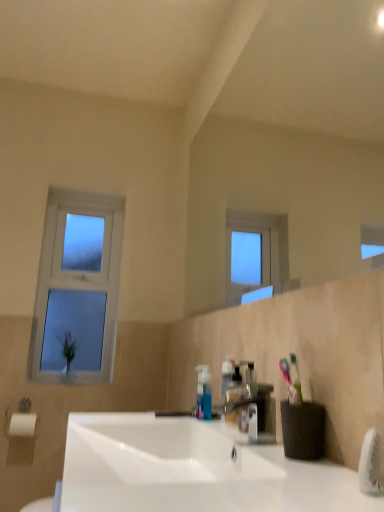
Locate an element on the screen. This screenshot has width=384, height=512. white glossy sink at center is located at coordinates (193, 469).

What do you see at coordinates (251, 409) in the screenshot?
I see `matte plastic tap at center` at bounding box center [251, 409].

Measure the distance between clear glass window at left and camera.

clear glass window at left is 7.07 feet from camera.

Identify the location of clear glass window at left. (77, 288).

Where is `white glossy sink at center`? The height and width of the screenshot is (512, 384). white glossy sink at center is located at coordinates (193, 469).

Who is more distant, clear glass window at left or matte plastic tap at center?

clear glass window at left is more distant.

In terms of width, does clear glass window at left look wider or thinner when compared to matte plastic tap at center?

In the image, clear glass window at left appears to be more narrow than matte plastic tap at center.

Does clear glass window at left turn towards matte plastic tap at center?

Yes, clear glass window at left is facing matte plastic tap at center.

Is clear glass window at left next to matte plastic tap at center and touching it?

No.

Consider the image. Who is bigger, white glossy sink at center or clear glass window at left?

With larger size is white glossy sink at center.

Is white glossy sink at center spatially inside clear glass window at left, or outside of it?

white glossy sink at center is not enclosed by clear glass window at left.

Is white glossy sink at center at the right side of clear glass window at left?

Yes, white glossy sink at center is to the right of clear glass window at left.

From the image's perspective, is white glossy sink at center on clear glass window at left?

Incorrect, from the image's perspective, white glossy sink at center is lower than clear glass window at left.

From the image's perspective, is matte plastic tap at center located beneath white glossy sink at center?

No, from the image's perspective, matte plastic tap at center is not beneath white glossy sink at center.

Could you tell me if matte plastic tap at center is turned towards white glossy sink at center?

No.

Based on the photo, from a real-world perspective, is matte plastic tap at center physically above white glossy sink at center?

Yes, from a real-world perspective, matte plastic tap at center is over white glossy sink at center

Is matte plastic tap at center completely or partially outside of white glossy sink at center?

Absolutely, matte plastic tap at center is external to white glossy sink at center.

Does white glossy sink at center turn towards matte plastic tap at center?

No, white glossy sink at center does not turn towards matte plastic tap at center.

Which object is wider, white glossy sink at center or matte plastic tap at center?

white glossy sink at center.

Between white glossy sink at center and matte plastic tap at center, which one has larger size?

With larger size is white glossy sink at center.

Considering the sizes of matte plastic tap at center and clear glass window at left in the image, is matte plastic tap at center taller or shorter than clear glass window at left?

Clearly, matte plastic tap at center is shorter compared to clear glass window at left.

Is matte plastic tap at center next to clear glass window at left?

Result: matte plastic tap at center and clear glass window at left are clearly separated.

Considering the points (256, 388) and (103, 376), which point is behind, point (256, 388) or point (103, 376)?

The point (103, 376) is behind.

Does matte plastic tap at center turn towards clear glass window at left?

No, matte plastic tap at center is not oriented towards clear glass window at left.

Image resolution: width=384 pixels, height=512 pixels. Identify the location of window above the white glossy sink at center (from a real-world perspective). (77, 288).

Can you confirm if clear glass window at left is shorter than white glossy sink at center?

In fact, clear glass window at left may be taller than white glossy sink at center.

Would you say clear glass window at left is a long distance from white glossy sink at center?

Yes, clear glass window at left and white glossy sink at center are quite far apart.

Where is `tap beneath the clear glass window at left (from a real-world perspective)`? This screenshot has width=384, height=512. tap beneath the clear glass window at left (from a real-world perspective) is located at coordinates [251, 409].

You are a GUI agent. You are given a task and a screenshot of the screen. Output one action in this format:
    pyautogui.click(x=<x>, y=<y>)
    Task: Click on the window located on the left of white glossy sink at center
    The width and height of the screenshot is (384, 512).
    Given the screenshot: What is the action you would take?
    point(77,288)

Considering their positions, is clear glass window at left positioned further to matte plastic tap at center than white glossy sink at center?

clear glass window at left.

Considering their positions, is clear glass window at left positioned further to white glossy sink at center than matte plastic tap at center?

clear glass window at left is positioned further to the anchor white glossy sink at center.

Estimate the real-world distances between objects in this image. Which object is closer to clear glass window at left, white glossy sink at center or matte plastic tap at center?

white glossy sink at center is closer to clear glass window at left.

When comparing their distances from matte plastic tap at center, does white glossy sink at center or clear glass window at left seem closer?

white glossy sink at center is positioned closer to the anchor matte plastic tap at center.

When comparing their distances from white glossy sink at center, does matte plastic tap at center or clear glass window at left seem further?

Among the two, clear glass window at left is located further to white glossy sink at center.

Based on their spatial positions, is matte plastic tap at center or white glossy sink at center further from clear glass window at left?

The object further to clear glass window at left is matte plastic tap at center.

Locate an element on the screen. This screenshot has height=512, width=384. tap positioned between white glossy sink at center and clear glass window at left from near to far is located at coordinates (251, 409).